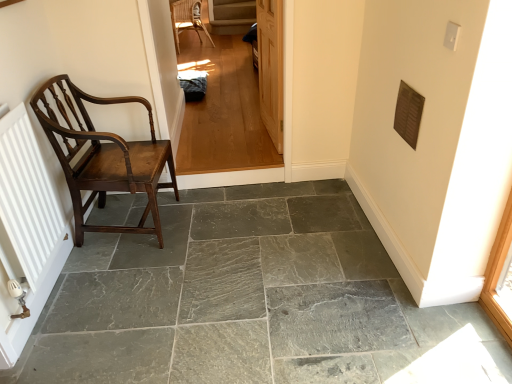
Question: From a real-world perspective, is wooden door at center on top of woven wicker chair at upper center, which ranks as the 2th chair in bottom-to-top order?

Choices:
 (A) yes
 (B) no

Answer: (A)

Question: Are wooden door at center and woven wicker chair at upper center, placed as the 1th chair when sorted from top to bottom, located far from each other?

Choices:
 (A) no
 (B) yes

Answer: (B)

Question: Can you confirm if wooden door at center is taller than woven wicker chair at upper center, which ranks as the 2th chair in bottom-to-top order?

Choices:
 (A) yes
 (B) no

Answer: (A)

Question: Is wooden door at center outside woven wicker chair at upper center, which ranks as the 2th chair in bottom-to-top order?

Choices:
 (A) yes
 (B) no

Answer: (A)

Question: Is wooden door at center directly adjacent to woven wicker chair at upper center, placed as the 1th chair when sorted from top to bottom?

Choices:
 (A) yes
 (B) no

Answer: (B)

Question: Is wooden door at center wider than woven wicker chair at upper center, which ranks as the 2th chair in bottom-to-top order?

Choices:
 (A) no
 (B) yes

Answer: (A)

Question: Does light brown wood floor at center have a smaller size compared to wooden door at center?

Choices:
 (A) yes
 (B) no

Answer: (B)

Question: Considering the relative sizes of light brown wood floor at center and wooden door at center in the image provided, is light brown wood floor at center thinner than wooden door at center?

Choices:
 (A) yes
 (B) no

Answer: (B)

Question: Does light brown wood floor at center lie in front of wooden door at center?

Choices:
 (A) yes
 (B) no

Answer: (A)

Question: Can you confirm if light brown wood floor at center is taller than wooden door at center?

Choices:
 (A) yes
 (B) no

Answer: (A)

Question: From a real-world perspective, is light brown wood floor at center physically above wooden door at center?

Choices:
 (A) yes
 (B) no

Answer: (B)

Question: Considering the relative positions of light brown wood floor at center and wooden door at center in the image provided, is light brown wood floor at center behind wooden door at center?

Choices:
 (A) no
 (B) yes

Answer: (A)

Question: From the image's perspective, does polished wood chair at left, marked as the second chair in a top-to-bottom arrangement, appear lower than light brown wood floor at center?

Choices:
 (A) no
 (B) yes

Answer: (B)